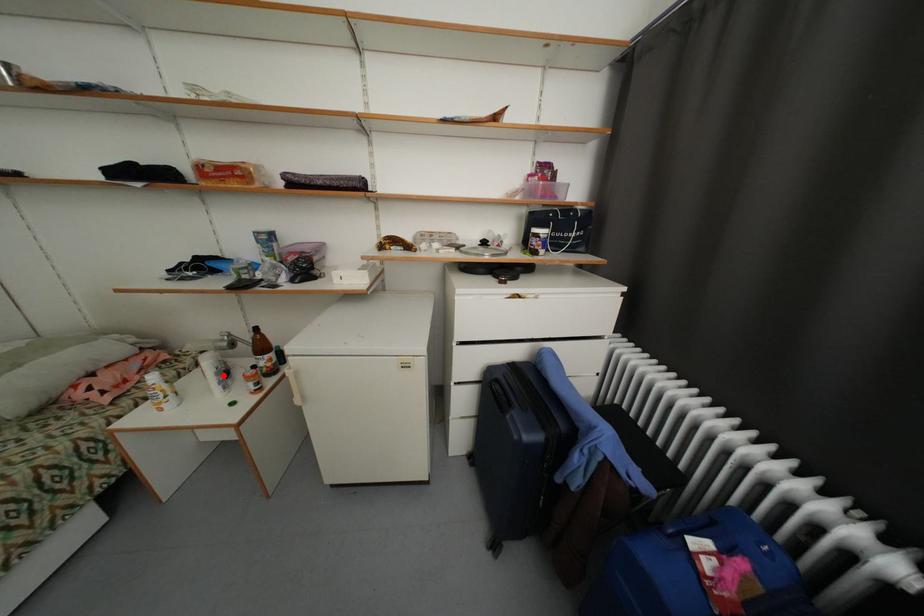
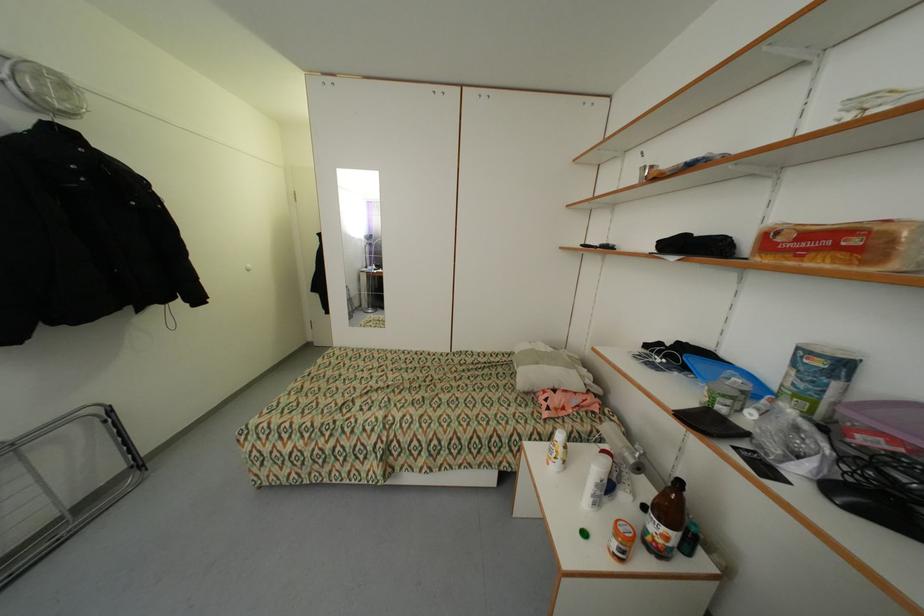
In the second image, find the point that corresponds to the highlighted location in the first image.

(603, 487)